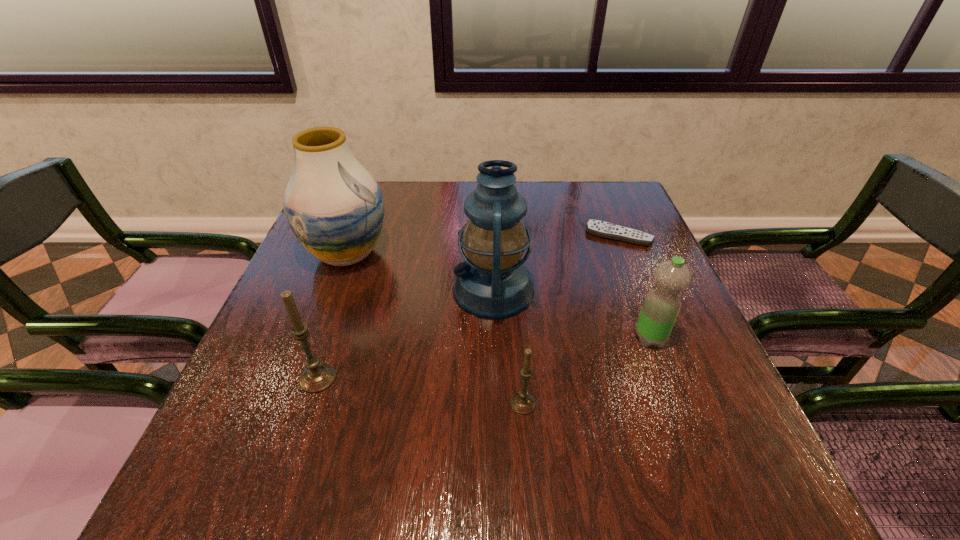
The candles are evenly distributed in the image. To maintain this, where would you place another candle on the right? Please point to a free space. Please provide its 2D coordinates. Your answer should be formatted as a tuple, i.e. [(x, y)], where the tuple contains the x and y coordinates of a point satisfying the conditions above.

[(750, 432)]